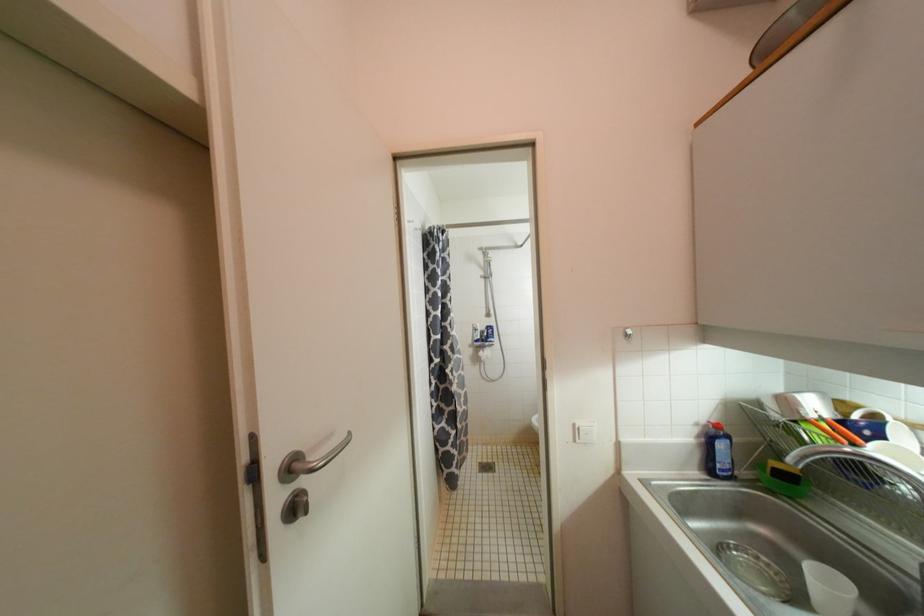
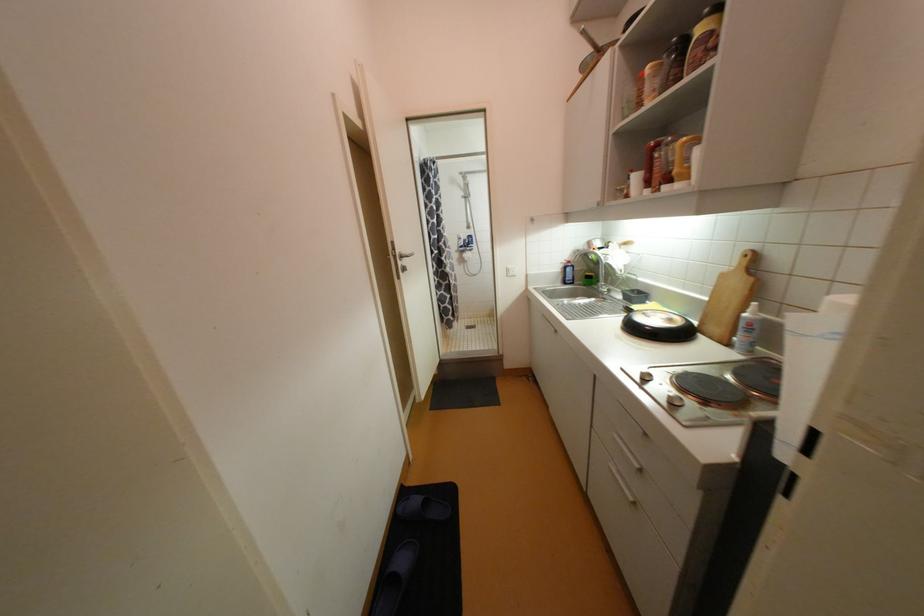
Question: I am providing you with two images of the same scene from different viewpoints. Please identify which objects are invisible in image2.

Choices:
 (A) white light switch
 (B) white spray bottle
 (C) wooden cutting board
 (D) none of these

Answer: (D)